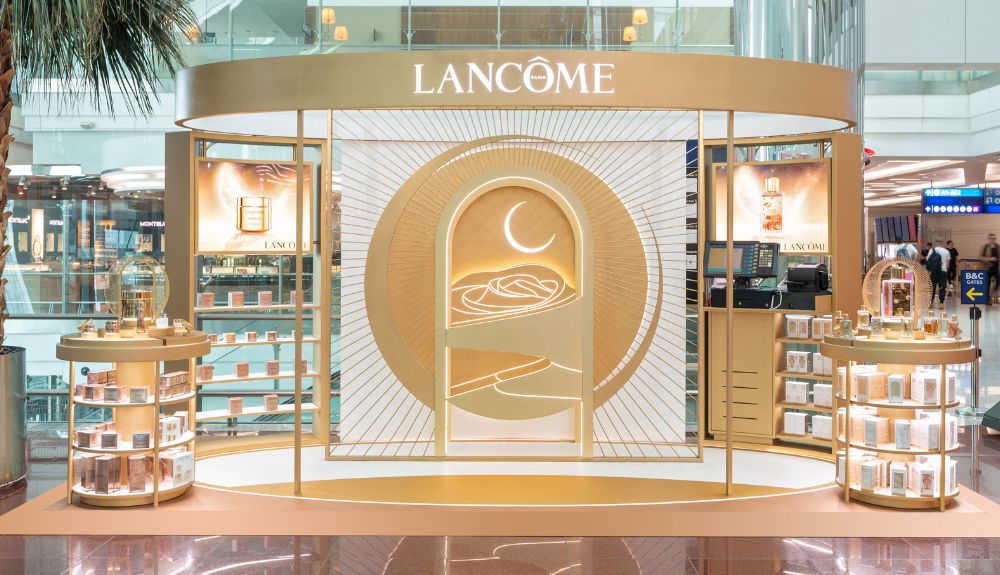
This screenshot has height=575, width=1000. In order to click on shelves in this screenshot , I will do `click(280, 310)`, `click(273, 334)`, `click(264, 366)`, `click(264, 406)`.